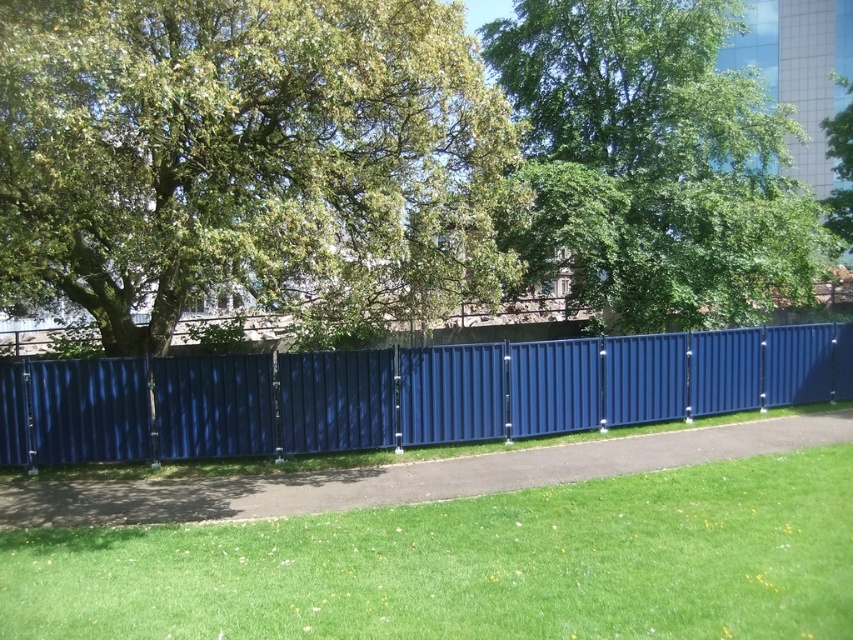
Between green leafy tree at upper center and metallic blue fence at center, which one is positioned higher?

green leafy tree at upper center is higher up.

Which is more to the right, green leafy tree at upper center or metallic blue fence at center?

From the viewer's perspective, green leafy tree at upper center appears more on the right side.

The image size is (853, 640). I want to click on green leafy tree at upper center, so coord(654,161).

Who is taller, green grass at lower center or metallic blue fence at center?

Standing taller between the two is metallic blue fence at center.

Does green grass at lower center have a greater width compared to metallic blue fence at center?

No.

The width and height of the screenshot is (853, 640). I want to click on green grass at lower center, so click(x=473, y=564).

I want to click on green grass at lower center, so click(473, 564).

Who is positioned more to the right, green leafy tree at upper center or green leafy tree at upper right?

Positioned to the right is green leafy tree at upper right.

Is point (784, 241) positioned in front of point (831, 124)?

Yes.

Describe the element at coordinates (654, 161) in the screenshot. Image resolution: width=853 pixels, height=640 pixels. I see `green leafy tree at upper center` at that location.

Locate an element on the screen. green leafy tree at upper center is located at coordinates (654, 161).